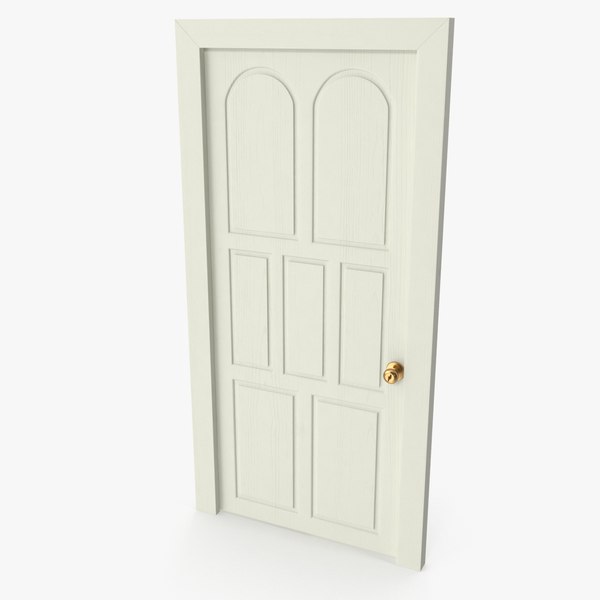
Locate an element on the screen. The height and width of the screenshot is (600, 600). door jamb is located at coordinates (244, 25).